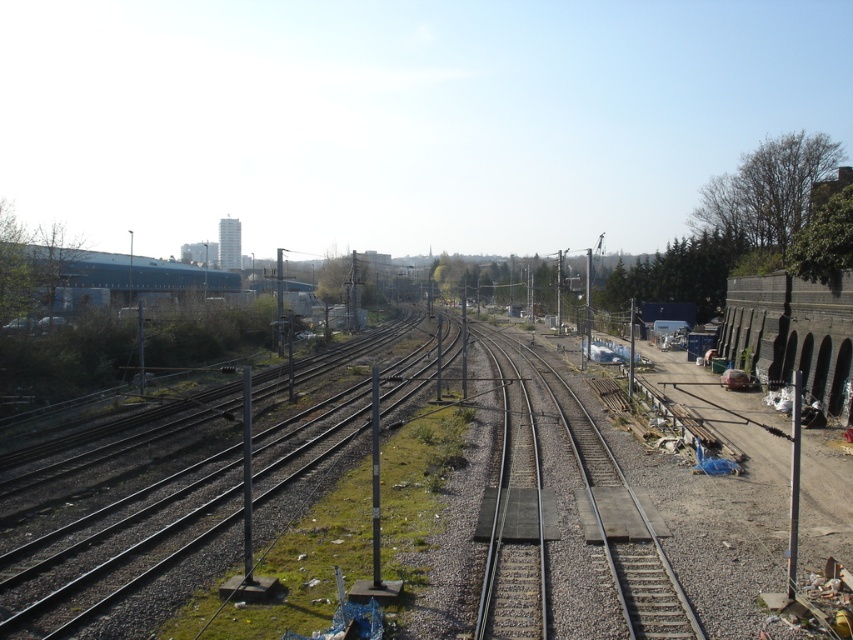
You are a railway engineer assessing the layout of the yard. You need to determine if the metallic gray train track at center can accommodate a standard freight train that requires a minimum track width of 1.5 meters. Given that the blue matte building at upper left is 20 meters wide, can the track support the freight train?

The metallic gray train track at center has a lesser width compared to the blue matte building at upper left, which is 20 meters wide. This means the track is narrower than 20 meters. Since the required minimum width is 1.5 meters and the track is narrower than 20 meters, it is possible that the track meets the requirement. However, without exact measurements, we cannot confirm if it is exactly 1.5 meters or narrower. Typically, standard railway tracks are around 1.435 meters between the rails, so it might